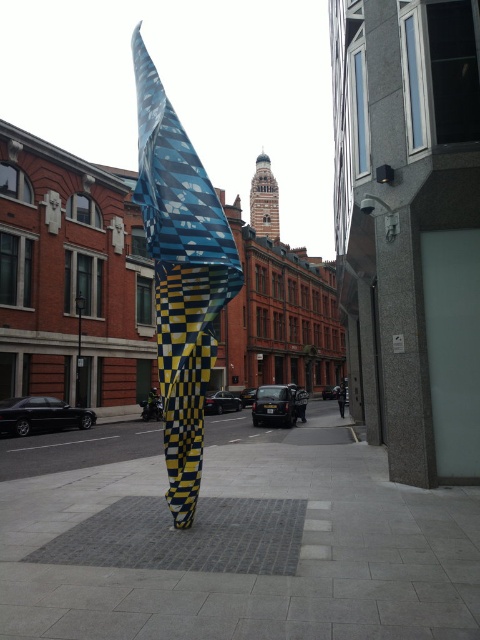
Between gray concrete pavement at center and blue and yellow checkered fabric at center, which one has more height?

Standing taller between the two is blue and yellow checkered fabric at center.

Does point (311, 467) come behind point (151, 81)?

Yes, it is behind point (151, 81).

Who is more forward, (330,595) or (171,330)?

Point (330,595) is in front.

Where is `gray concrete pavement at center`? The height and width of the screenshot is (640, 480). gray concrete pavement at center is located at coordinates (233, 540).